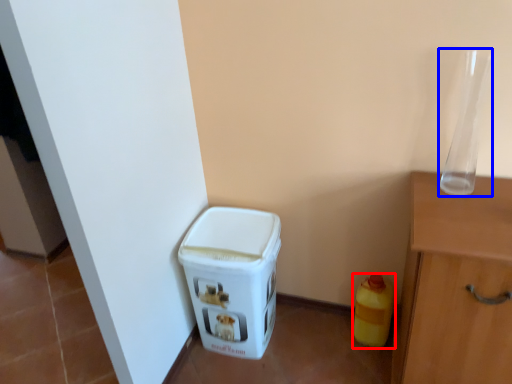
Question: Which object is further to the camera taking this photo, bottle (highlighted by a red box) or glass vase (highlighted by a blue box)?

Choices:
 (A) bottle
 (B) glass vase

Answer: (A)